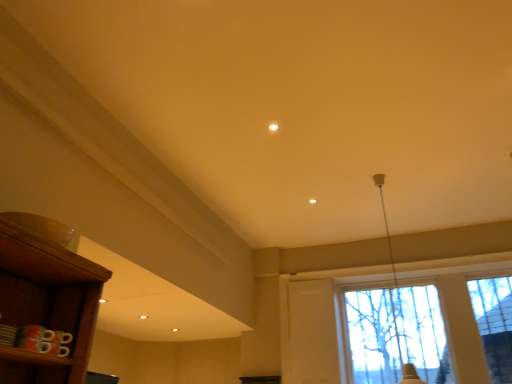
The width and height of the screenshot is (512, 384). What are the coordinates of `transparent glass window at center` in the screenshot? It's located at (321, 322).

Measure the distance between point (468, 256) and camera.

Point (468, 256) is 4.34 meters away from camera.

Describe the element at coordinates (321, 322) in the screenshot. I see `transparent glass window at center` at that location.

What do you see at coordinates (401, 353) in the screenshot?
I see `white glossy lampshade at upper right` at bounding box center [401, 353].

This screenshot has width=512, height=384. Identify the location of white glossy lampshade at upper right. (401, 353).

Identify the location of transparent glass window at center. This screenshot has height=384, width=512. click(321, 322).

Between white glossy lampshade at upper right and transparent glass window at center, which one appears on the left side from the viewer's perspective?

white glossy lampshade at upper right is more to the left.

Which object is further away from the camera taking this photo, white glossy lampshade at upper right or transparent glass window at center?

transparent glass window at center.

Considering the positions of point (403, 372) and point (305, 345), is point (403, 372) closer or farther from the camera than point (305, 345)?

Point (403, 372) is farther from the camera than point (305, 345).

From the image's perspective, which is below, white glossy lampshade at upper right or transparent glass window at center?

From the image's view, transparent glass window at center is below.

From a real-world perspective, is white glossy lampshade at upper right physically above transparent glass window at center?

Correct, in the physical world, white glossy lampshade at upper right is higher than transparent glass window at center.

Between white glossy lampshade at upper right and transparent glass window at center, which one has larger width?

white glossy lampshade at upper right.

Which of these two, white glossy lampshade at upper right or transparent glass window at center, stands taller?

With more height is white glossy lampshade at upper right.

Does white glossy lampshade at upper right have a larger size compared to transparent glass window at center?

Correct, white glossy lampshade at upper right is larger in size than transparent glass window at center.

Is transparent glass window at center completely or partially inside white glossy lampshade at upper right?

No, transparent glass window at center is not surrounded by white glossy lampshade at upper right.

Is white glossy lampshade at upper right not close to transparent glass window at center?

No.

Looking at this image, is white glossy lampshade at upper right aimed at transparent glass window at center?

No, white glossy lampshade at upper right is not oriented towards transparent glass window at center.

How many degrees apart are the facing directions of white glossy lampshade at upper right and transparent glass window at center?

The facing directions of white glossy lampshade at upper right and transparent glass window at center are 87.5 degrees apart.

You are a GUI agent. You are given a task and a screenshot of the screen. Output one action in this format:
    pyautogui.click(x=<x>, y=<y>)
    Task: Click on the lamp on the left of transparent glass window at center
    The image size is (512, 384).
    Given the screenshot: What is the action you would take?
    pyautogui.click(x=401, y=353)

Does transparent glass window at center appear on the left side of white glossy lampshade at upper right?

In fact, transparent glass window at center is to the right of white glossy lampshade at upper right.

From the picture: Which is behind, transparent glass window at center or white glossy lampshade at upper right?

→ transparent glass window at center is further away from the camera.

Between point (468, 305) and point (394, 326), which one is positioned behind?

The point (394, 326) is farther.

From the picture: From the image's perspective, who appears lower, transparent glass window at center or white glossy lampshade at upper right?

From the image's view, transparent glass window at center is below.

From a real-world perspective, is transparent glass window at center physically located above or below white glossy lampshade at upper right?

From a real-world perspective, transparent glass window at center is physically below white glossy lampshade at upper right.

Looking at their sizes, would you say transparent glass window at center is wider or thinner than white glossy lampshade at upper right?

In the image, transparent glass window at center appears to be more narrow than white glossy lampshade at upper right.

Between transparent glass window at center and white glossy lampshade at upper right, which one has more height?

With more height is white glossy lampshade at upper right.

Based on the photo, based on their sizes in the image, would you say transparent glass window at center is bigger or smaller than white glossy lampshade at upper right?

Clearly, transparent glass window at center is smaller in size than white glossy lampshade at upper right.

Is transparent glass window at center located outside white glossy lampshade at upper right?

That's correct, transparent glass window at center is outside of white glossy lampshade at upper right.

Is transparent glass window at center with white glossy lampshade at upper right?

No.

Is transparent glass window at center facing away from white glossy lampshade at upper right?

Yes, white glossy lampshade at upper right is at the back of transparent glass window at center.

What's the angular difference between transparent glass window at center and white glossy lampshade at upper right's facing directions?

There is a 87.5-degree angle between the facing directions of transparent glass window at center and white glossy lampshade at upper right.

Identify the location of lamp in front of the transparent glass window at center. The image size is (512, 384). (401, 353).

Locate an element on the screen. lamp on the left of transparent glass window at center is located at coordinates (401, 353).

Find the location of `lamp located above the transparent glass window at center (from a real-world perspective)`. lamp located above the transparent glass window at center (from a real-world perspective) is located at coordinates (401, 353).